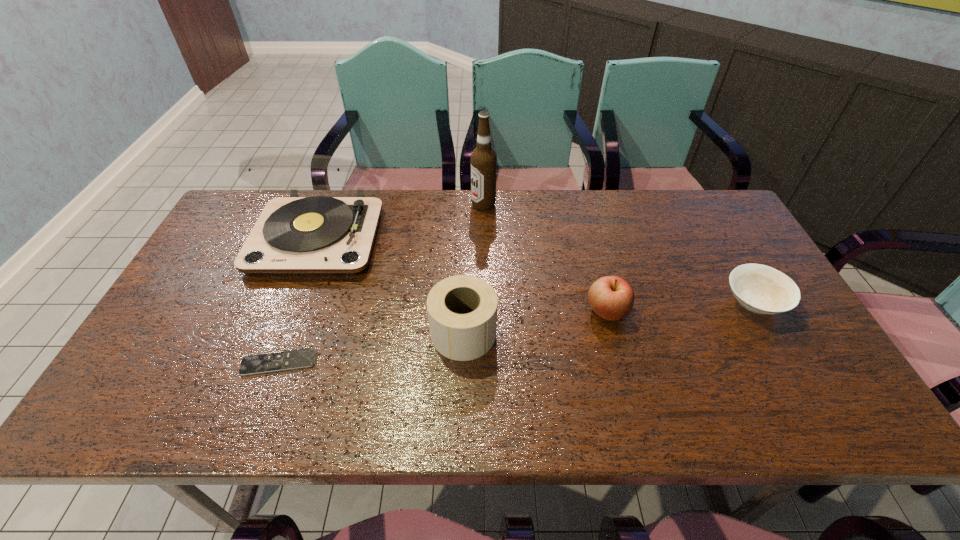
Identify the location of vacant space located 0.210m with the tonearm facing the front of the record player. (277, 342).

The width and height of the screenshot is (960, 540). I want to click on blank space located 0.200m on the right of the toilet tissue, so click(x=578, y=333).

I want to click on free location located on the back of the apple, so click(583, 218).

Locate an element on the screen. This screenshot has height=540, width=960. vacant space located on the front of the bowl is located at coordinates (819, 418).

Identify the location of vacant space located 0.290m on the right of the remote control. The height and width of the screenshot is (540, 960). (441, 362).

The width and height of the screenshot is (960, 540). Identify the location of alcohol present at the far edge. (483, 158).

What are the coordinates of `record player present at the far edge` in the screenshot? It's located at (319, 235).

This screenshot has height=540, width=960. In order to click on object that is at the left edge in this screenshot , I will do `click(319, 235)`.

The width and height of the screenshot is (960, 540). Identify the location of object present at the right edge. (761, 289).

The height and width of the screenshot is (540, 960). Find the location of `object that is at the far left corner`. object that is at the far left corner is located at coordinates (319, 235).